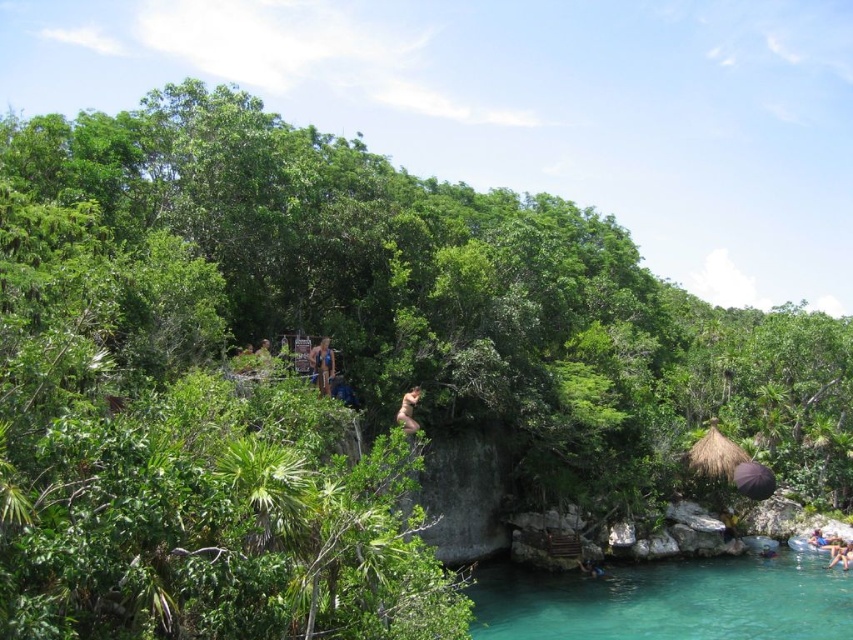
Does tan skin person at center have a greater width compared to brown leather backpack at lower right?

Correct, the width of tan skin person at center exceeds that of brown leather backpack at lower right.

Which is behind, point (842, 552) or point (601, 577)?

The point (842, 552) is more distant.

Where is `tan skin person at center`? This screenshot has width=853, height=640. tan skin person at center is located at coordinates coord(840,556).

In the scene shown: Between matte blue swimsuit at center and tan skin person at center, which one has less height?

tan skin person at center

Does matte blue swimsuit at center lie behind tan skin person at center?

That is False.

At what (x,y) coordinates should I click in order to perform the action: click on matte blue swimsuit at center. Please return your answer as a coordinate pair (x, y). Looking at the image, I should click on (322, 365).

You are a GUI agent. You are given a task and a screenshot of the screen. Output one action in this format:
    pyautogui.click(x=<x>, y=<y>)
    Task: Click on the matte blue swimsuit at center
    Image resolution: width=853 pixels, height=640 pixels.
    Given the screenshot: What is the action you would take?
    pyautogui.click(x=322, y=365)

Who is more distant from viewer, (786, 611) or (579, 561)?

The point (579, 561) is behind.

Can you confirm if teal glassy water at lower center is positioned above brown leather backpack at lower right?

No.

You are a GUI agent. You are given a task and a screenshot of the screen. Output one action in this format:
    pyautogui.click(x=<x>, y=<y>)
    Task: Click on the teal glassy water at lower center
    
    Given the screenshot: What is the action you would take?
    pyautogui.click(x=668, y=600)

Image resolution: width=853 pixels, height=640 pixels. Find the location of `teal glassy water at lower center`. teal glassy water at lower center is located at coordinates (668, 600).